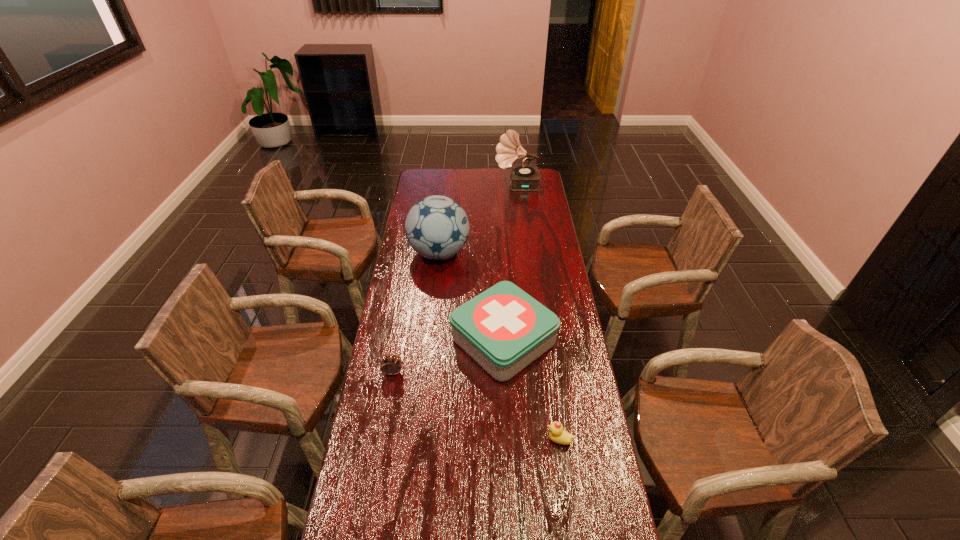
What are the coordinates of `the farthest object` in the screenshot? It's located at (523, 177).

You are a GUI agent. You are given a task and a screenshot of the screen. Output one action in this format:
    pyautogui.click(x=<x>, y=<y>)
    Task: Click on the second farthest object
    The width and height of the screenshot is (960, 540).
    Given the screenshot: What is the action you would take?
    pyautogui.click(x=437, y=227)

In order to click on the fourth shortest object in this screenshot , I will do `click(437, 227)`.

Where is `the third tallest object`? the third tallest object is located at coordinates (504, 329).

This screenshot has height=540, width=960. Find the location of `alarm clock`. alarm clock is located at coordinates (391, 365).

Identify the location of duckling. (557, 434).

Where is `the shortest object`? The image size is (960, 540). the shortest object is located at coordinates (557, 434).

Find the location of a particular element. free space located 0.130m from the horn of the farthest object is located at coordinates (471, 186).

I want to click on vacant region located 0.090m from the horn of the farthest object, so click(x=479, y=186).

At what (x,y) coordinates should I click in order to perform the action: click on free space located from the horn of the farthest object. Please return your answer as a coordinate pair (x, y). Looking at the image, I should click on (442, 186).